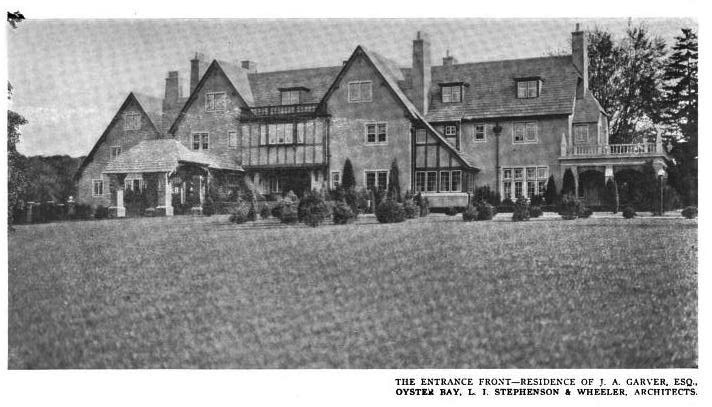
Where is `chimney`? chimney is located at coordinates (169, 86), (193, 66), (246, 63), (424, 64), (446, 57), (581, 57).